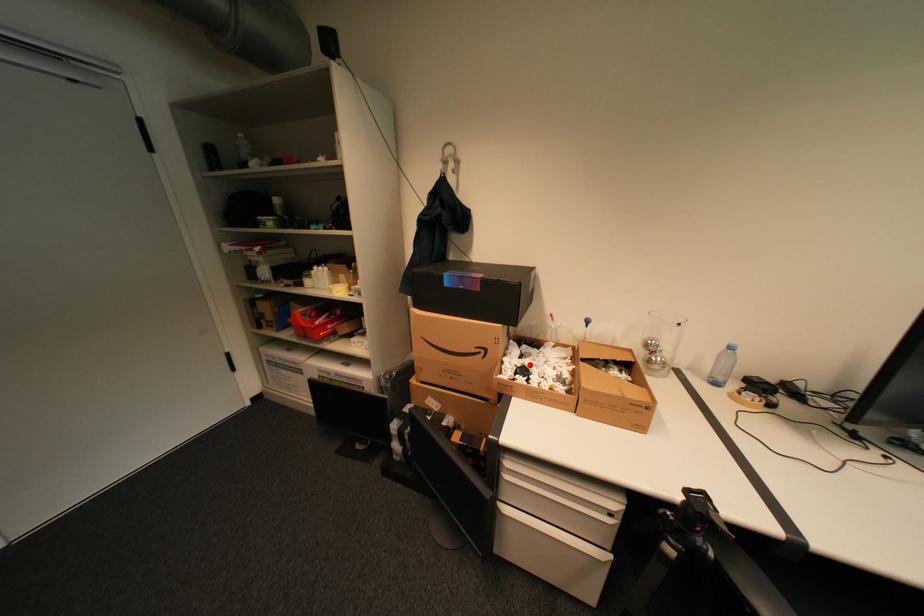
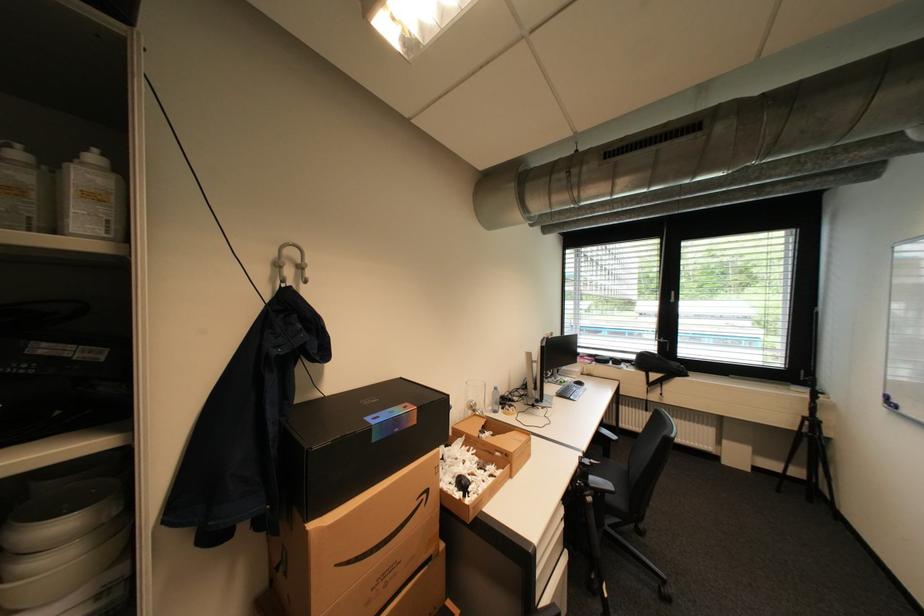
In the second image, find the point that corresponds to the highlighted location in the first image.

(462, 477)